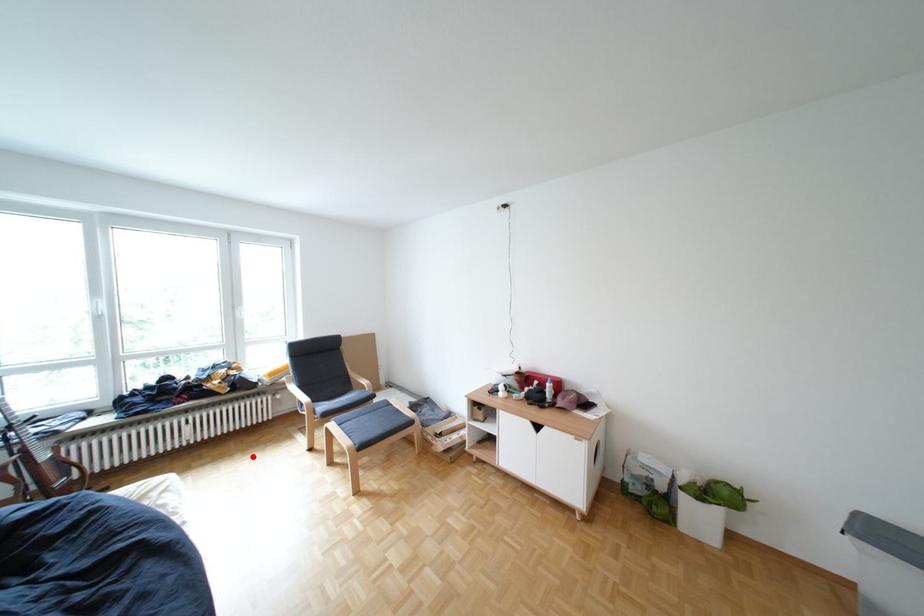
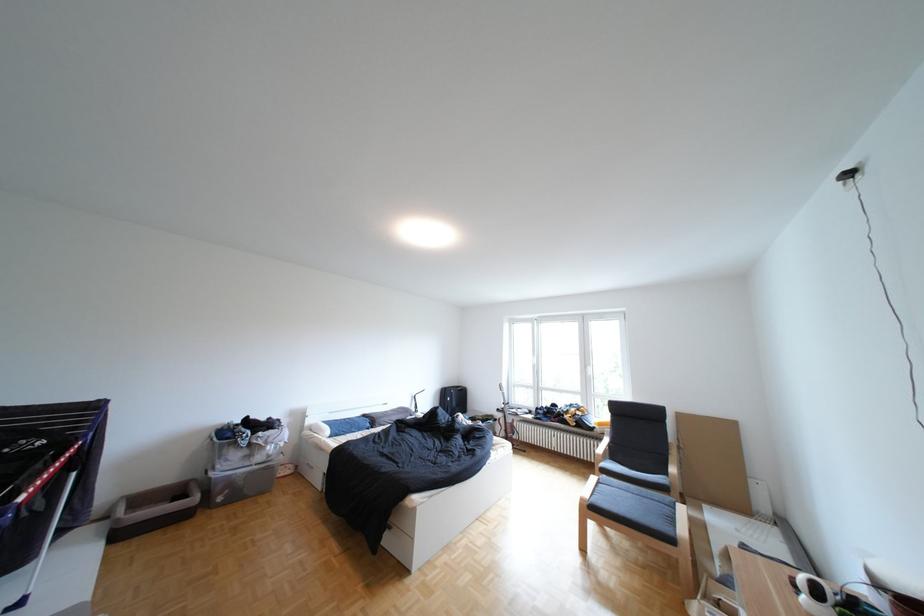
Question: A red point is marked in image1. In image2, is the corresponding 3D point closer to the camera or farther? Reply with the corresponding letter.

Choices:
 (A) The corresponding 3D point is closer.
 (B) The corresponding 3D point is farther.

Answer: (B)